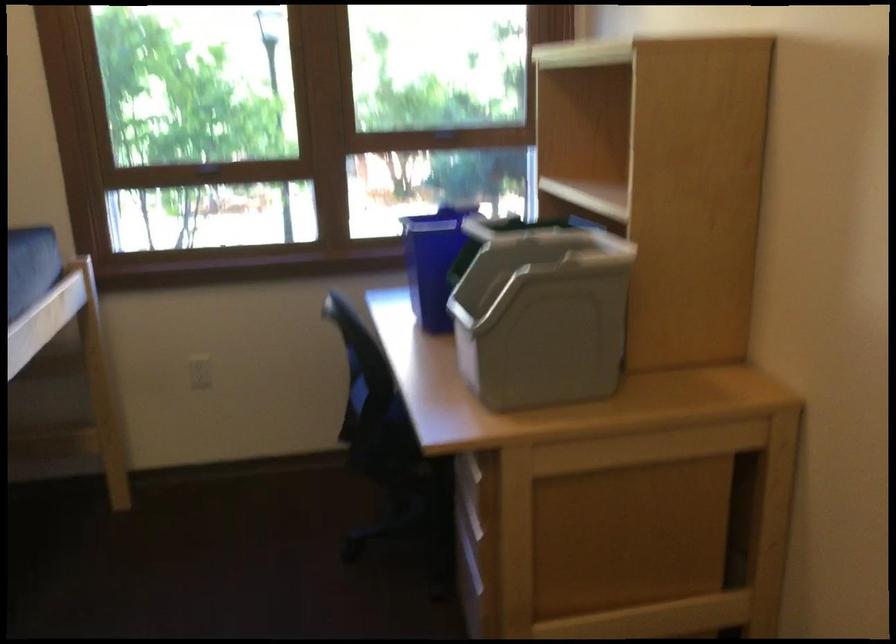
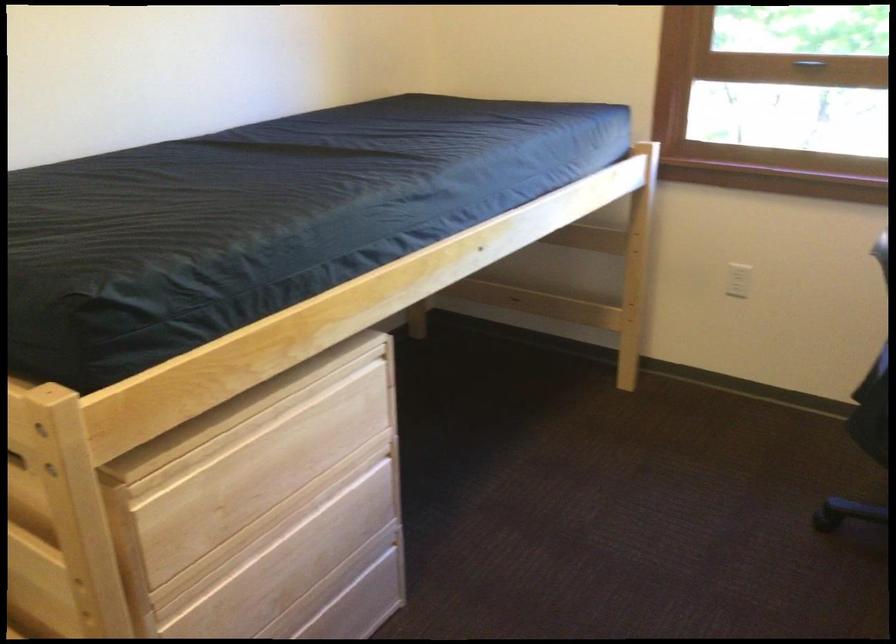
The point at (205, 372) is marked in the first image. Where is the corresponding point in the second image?

(738, 279)